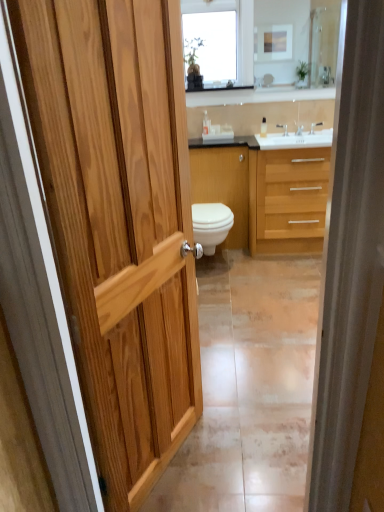
Question: Is white glossy toilet at center not inside silver metallic faucet at upper center?

Choices:
 (A) yes
 (B) no

Answer: (A)

Question: Is white glossy toilet at center beside silver metallic faucet at upper center?

Choices:
 (A) no
 (B) yes

Answer: (A)

Question: Is silver metallic faucet at upper center at the back of white glossy toilet at center?

Choices:
 (A) no
 (B) yes

Answer: (A)

Question: From a real-world perspective, is white glossy toilet at center on silver metallic faucet at upper center?

Choices:
 (A) yes
 (B) no

Answer: (B)

Question: Considering the relative sizes of white glossy toilet at center and silver metallic faucet at upper center in the image provided, is white glossy toilet at center shorter than silver metallic faucet at upper center?

Choices:
 (A) yes
 (B) no

Answer: (B)

Question: Does white glossy toilet at center turn towards silver metallic faucet at upper center?

Choices:
 (A) no
 (B) yes

Answer: (A)

Question: From the image's perspective, does clear glass mirror at upper center appear lower than white glossy cabinet at center?

Choices:
 (A) no
 (B) yes

Answer: (A)

Question: Is the position of clear glass mirror at upper center less distant than that of white glossy cabinet at center?

Choices:
 (A) yes
 (B) no

Answer: (A)

Question: Is clear glass mirror at upper center positioned with its back to white glossy cabinet at center?

Choices:
 (A) yes
 (B) no

Answer: (B)

Question: From a real-world perspective, is clear glass mirror at upper center beneath white glossy cabinet at center?

Choices:
 (A) yes
 (B) no

Answer: (B)

Question: Is clear glass mirror at upper center positioned behind white glossy cabinet at center?

Choices:
 (A) yes
 (B) no

Answer: (B)

Question: Considering the relative sizes of clear glass mirror at upper center and white glossy cabinet at center in the image provided, is clear glass mirror at upper center shorter than white glossy cabinet at center?

Choices:
 (A) yes
 (B) no

Answer: (A)

Question: Would you say white glossy cabinet at center contains light wood/woodenmaterial/texture bathroom cabinet at center?

Choices:
 (A) yes
 (B) no

Answer: (B)